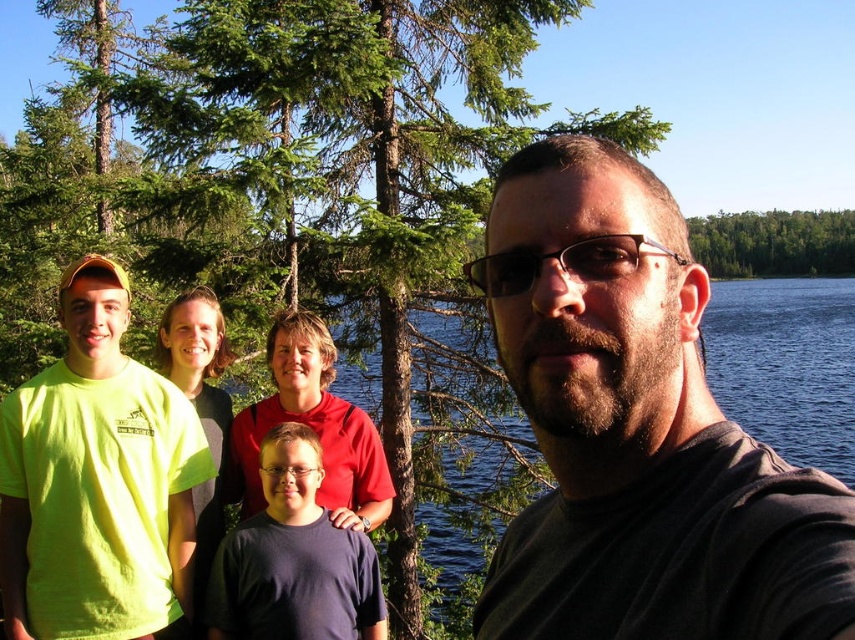
Question: Does dark gray t-shirt at center appear on the left side of dark blue t-shirt at center?

Choices:
 (A) yes
 (B) no

Answer: (B)

Question: Which object appears farthest from the camera in this image?

Choices:
 (A) dark blue t-shirt at center
 (B) dark gray t-shirt at center
 (C) neon yellow t-shirt at left

Answer: (A)

Question: Does dark gray t-shirt at center appear on the left side of neon yellow t-shirt at left?

Choices:
 (A) no
 (B) yes

Answer: (A)

Question: Which point appears closest to the camera in this image?

Choices:
 (A) (69, 620)
 (B) (310, 429)
 (C) (687, 472)

Answer: (C)

Question: Is dark gray t-shirt at center further to the viewer compared to dark blue t-shirt at center?

Choices:
 (A) yes
 (B) no

Answer: (B)

Question: Which point appears farthest from the camera in this image?

Choices:
 (A) (726, 556)
 (B) (214, 561)

Answer: (B)